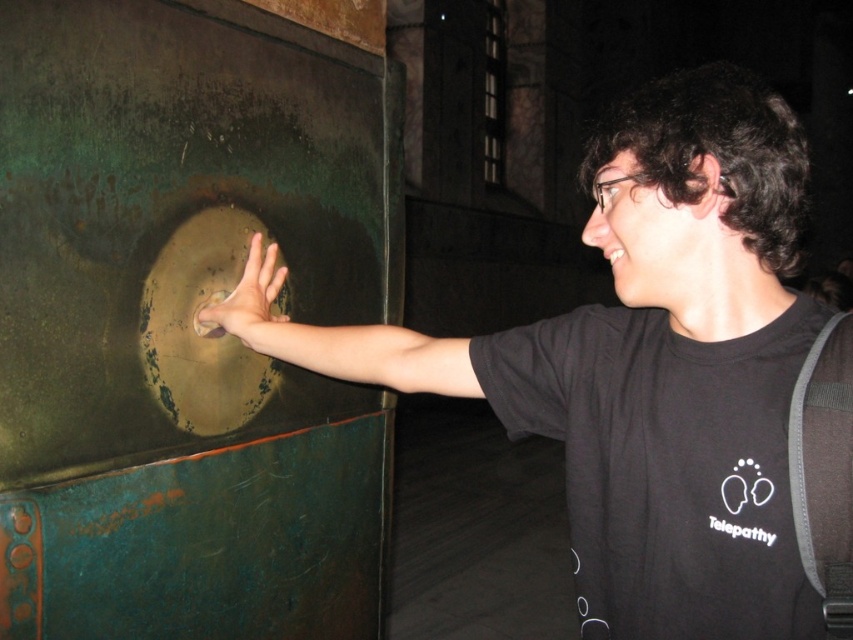
Is matte green door handle at center-left to the right of smooth bronze hand at center from the viewer's perspective?

Correct, you'll find matte green door handle at center-left to the right of smooth bronze hand at center.

Does point (633, 572) come closer to viewer compared to point (228, 300)?

Yes, point (633, 572) is in front of point (228, 300).

Is point (819, 392) positioned before point (250, 237)?

Yes, it is in front of point (250, 237).

Find the location of a particular element. Image resolution: width=853 pixels, height=640 pixels. matte green door handle at center-left is located at coordinates (660, 371).